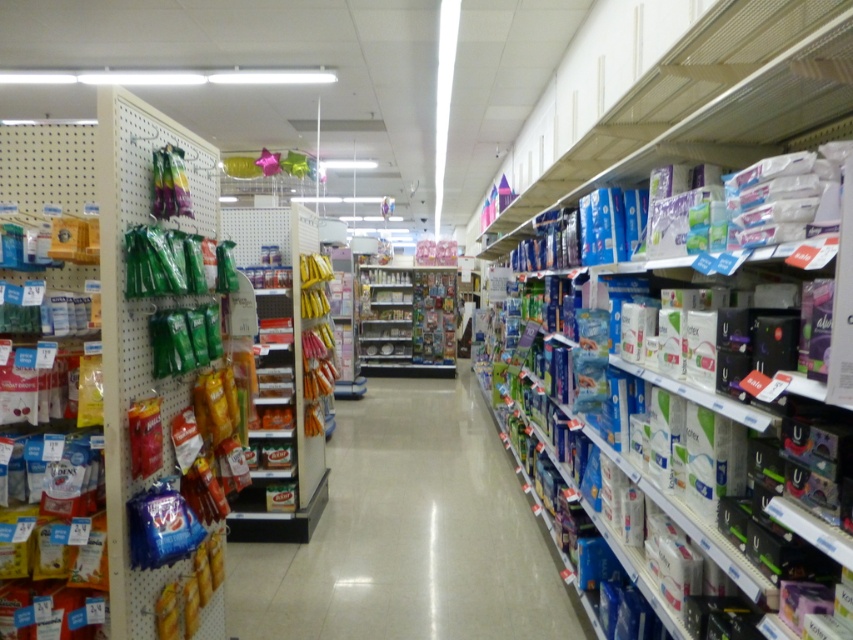
Question: Which object is positioned closest to the blue plastic shelf at center?

Choices:
 (A) green matte snack packet at left
 (B) metallic silver shelves at center

Answer: (A)

Question: Which object is the closest to the blue plastic shelf at center?

Choices:
 (A) green matte snack packet at left
 (B) white matte sanitary pads at right

Answer: (A)

Question: Among these objects, which one is farthest from the camera?

Choices:
 (A) metallic silver shelves at center
 (B) blue plastic shelf at center
 (C) green matte snack packet at left
 (D) white matte sanitary pads at right

Answer: (A)

Question: Does blue plastic shelf at center have a lesser width compared to metallic silver shelves at center?

Choices:
 (A) yes
 (B) no

Answer: (B)

Question: Does green matte snack packet at left have a greater width compared to white matte sanitary pads at right?

Choices:
 (A) yes
 (B) no

Answer: (A)

Question: Can you confirm if green matte snack packet at left is bigger than metallic silver shelves at center?

Choices:
 (A) no
 (B) yes

Answer: (A)